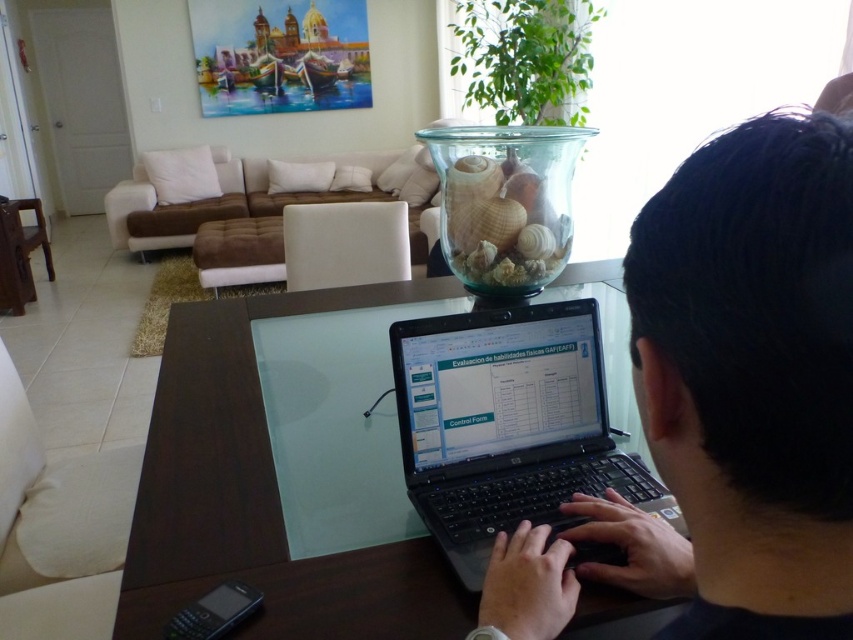
You have a new tablet that is 12 inches wide. You want to place it on the transparent glass table at center next to the black matte laptop at center. Can the tablet fit on the table without overlapping the laptop?

The black matte laptop at center is narrower than the transparent glass table at center. Since the tablet is 12 inches wide, it should fit on the table as long as there is enough space beside the laptop. However, the exact placement depends on the available space between the laptop and the table edge.

You are a delivery person who needs to place a package on the transparent glass table at center and the black plastic laptop at center. Which object should you place the package on to ensure it doesn not obstruct the laptop?

You should place the package on the transparent glass table at center because it is located above the black plastic laptop at center, so placing it there would not block the laptop.

Consider the image. You are a delivery robot that needs to place a package on the table. The table has a glass top. Where should you place the package so that it doesn not obstruct the laptop or the phone? The coordinates of the table are given as a point at (265, 483). Please provide the coordinates of the available space on the table.

The point at (265, 483) is on the transparent glass table at center, so placing the package there would not obstruct the laptop or the phone since it is an available space on the table.